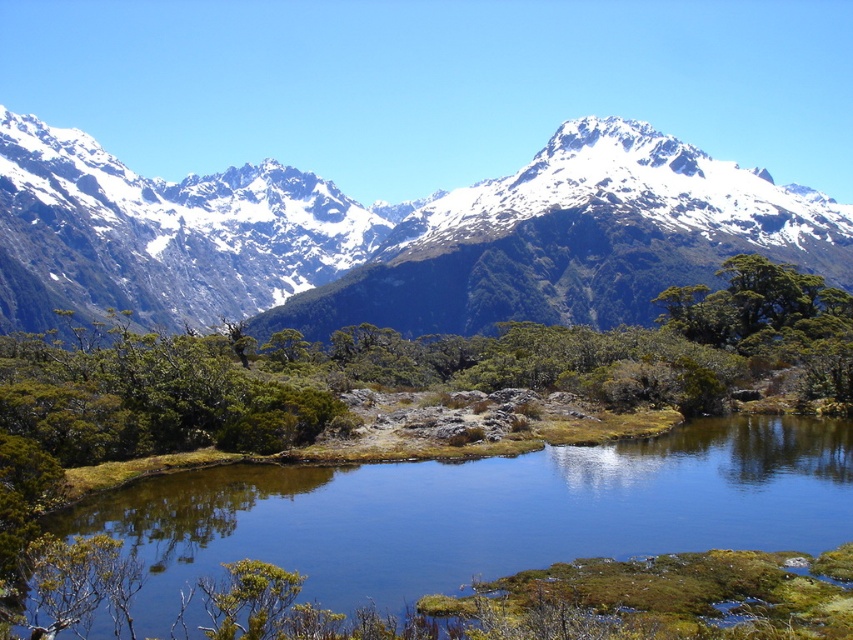
Based on the photo, does white snow-covered mountain range at upper center appear over green mossy water at center?

Yes.

Is white snow-covered mountain range at upper center thinner than green mossy water at center?

No.

The height and width of the screenshot is (640, 853). What do you see at coordinates (392, 236) in the screenshot? I see `white snow-covered mountain range at upper center` at bounding box center [392, 236].

Find the location of a particular element. This screenshot has height=640, width=853. white snow-covered mountain range at upper center is located at coordinates (392, 236).